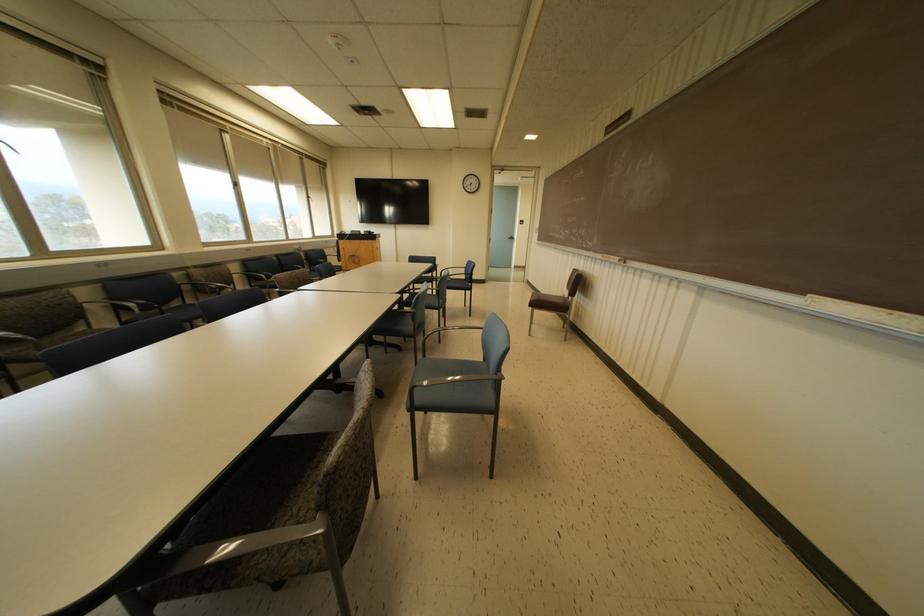
I want to click on blue chair armrest, so click(458, 330).